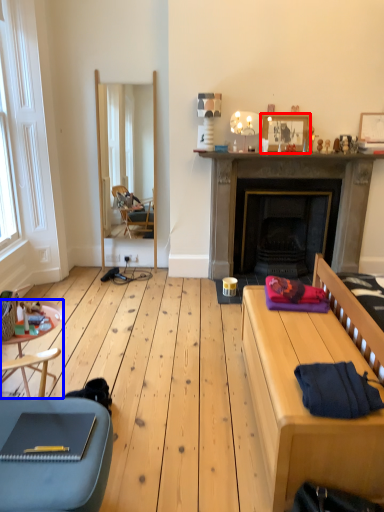
Question: Which of the following is the farthest to the observer, picture frame (highlighted by a red box) or side table (highlighted by a blue box)?

Choices:
 (A) picture frame
 (B) side table

Answer: (A)